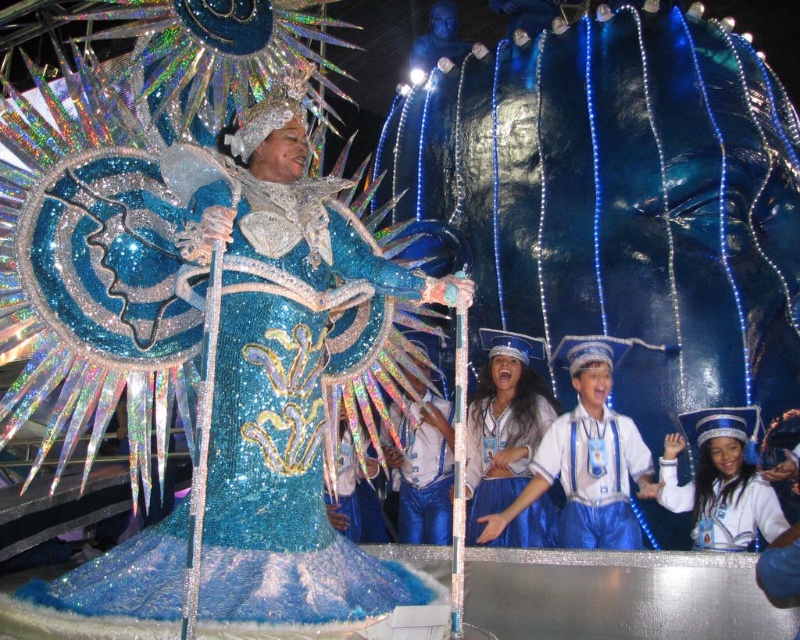
You are a photographer trying to capture a photo of the blue sequined pants at center and the shiny blue hat at lower right. The camera you are using has a maximum focus range of 25 meters. Will you be able to capture both objects in focus simultaneously?

The shiny blue hat at lower right and blue sequined pants at center are 24.46 meters apart. Since the distance between them is within the camera maximum focus range of 25 meters, you can capture both objects in focus simultaneously.

You are a photographer at the event and want to capture a photo that includes both the shiny blue hat at lower right and the blue sequined skirt at center. Which object should you focus on first to ensure both are in frame?

Since the shiny blue hat at lower right is shorter than the blue sequined skirt at center, you should focus on the shiny blue hat at lower right first to ensure both are in frame.

You are a photographer standing at point (396,291). You want to capture the entire group of performers in one shot. The camera has a maximum zoom range of 50 meters. Can you fit them all in the frame?

The performers are 59.46 meters apart, which exceeds the camera maximum zoom range of 50 meters. You cannot fit them all in the frame.